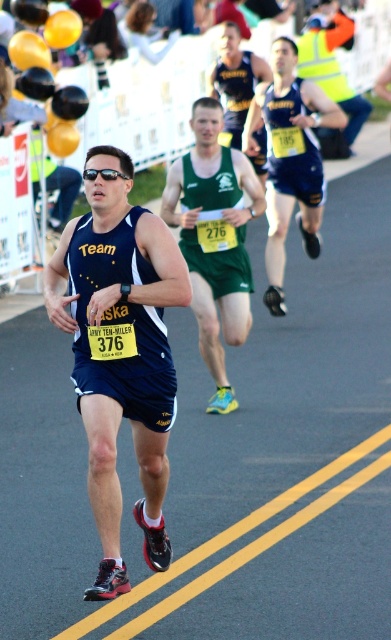
Is matte blue singlet at center smaller than yellow reflective vest at upper right?

Indeed, matte blue singlet at center has a smaller size compared to yellow reflective vest at upper right.

Does matte blue singlet at center have a lesser height compared to yellow reflective vest at upper right?

Yes, matte blue singlet at center is shorter than yellow reflective vest at upper right.

Between point (168, 349) and point (346, 13), which one is positioned in front?

Positioned in front is point (168, 349).

Where is `matte blue singlet at center`? The height and width of the screenshot is (640, 391). matte blue singlet at center is located at coordinates (120, 349).

Can you confirm if blue athletic shorts at center is positioned to the right of yellow reflective vest at upper right?

Incorrect, blue athletic shorts at center is not on the right side of yellow reflective vest at upper right.

You are a GUI agent. You are given a task and a screenshot of the screen. Output one action in this format:
    pyautogui.click(x=<x>, y=<y>)
    Task: Click on the blue athletic shorts at center
    
    Given the screenshot: What is the action you would take?
    pyautogui.click(x=290, y=160)

The image size is (391, 640). Find the location of `blue athletic shorts at center`. blue athletic shorts at center is located at coordinates (290, 160).

Who is positioned more to the right, green fabric running suit at center or blue athletic shorts at center?

blue athletic shorts at center is more to the right.

Image resolution: width=391 pixels, height=640 pixels. Describe the element at coordinates (215, 237) in the screenshot. I see `green fabric running suit at center` at that location.

Is point (260, 189) closer to viewer compared to point (269, 177)?

Yes, point (260, 189) is closer to viewer.

The width and height of the screenshot is (391, 640). Identify the location of green fabric running suit at center. (215, 237).